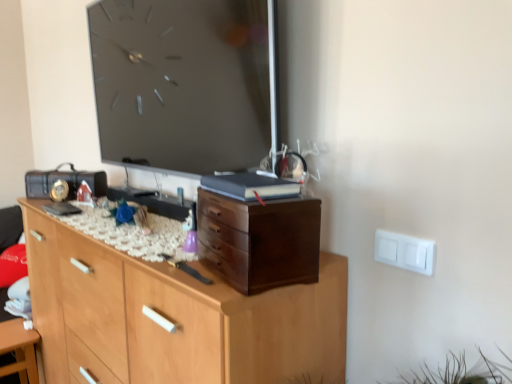
Question: Is white glossy table at lower left oriented towards dark wood chest of drawers at center, placed as the 1th chest of drawers when sorted from top to bottom?

Choices:
 (A) yes
 (B) no

Answer: (B)

Question: Is white glossy table at lower left further to the viewer compared to dark wood chest of drawers at center, placed as the 1th chest of drawers when sorted from top to bottom?

Choices:
 (A) yes
 (B) no

Answer: (A)

Question: Is white glossy table at lower left with dark wood chest of drawers at center, placed as the 1th chest of drawers when sorted from top to bottom?

Choices:
 (A) no
 (B) yes

Answer: (A)

Question: From the image's perspective, is white glossy table at lower left located beneath dark wood chest of drawers at center, placed as the 1th chest of drawers when sorted from top to bottom?

Choices:
 (A) no
 (B) yes

Answer: (B)

Question: Are white glossy table at lower left and dark wood chest of drawers at center, which appears as the second chest of drawers when ordered from the bottom, far apart?

Choices:
 (A) no
 (B) yes

Answer: (B)

Question: In terms of width, does dark wood chest of drawers at center, placed as the 1th chest of drawers when sorted from top to bottom, look wider or thinner when compared to white glossy table at lower left?

Choices:
 (A) thin
 (B) wide

Answer: (B)

Question: Would you say dark wood chest of drawers at center, placed as the 1th chest of drawers when sorted from top to bottom, is to the left or to the right of white glossy table at lower left in the picture?

Choices:
 (A) left
 (B) right

Answer: (B)

Question: In terms of height, does dark wood chest of drawers at center, which appears as the second chest of drawers when ordered from the bottom, look taller or shorter compared to white glossy table at lower left?

Choices:
 (A) tall
 (B) short

Answer: (B)

Question: Relative to white glossy table at lower left, is dark wood chest of drawers at center, which appears as the second chest of drawers when ordered from the bottom, in front or behind?

Choices:
 (A) behind
 (B) front

Answer: (B)

Question: In terms of height, does wooden chest of drawers at center, the first chest of drawers ordered from the bottom, look taller or shorter compared to white glossy table at lower left?

Choices:
 (A) tall
 (B) short

Answer: (A)

Question: From a real-world perspective, relative to white glossy table at lower left, is wooden chest of drawers at center, the first chest of drawers ordered from the bottom, vertically above or below?

Choices:
 (A) above
 (B) below

Answer: (A)

Question: Is wooden chest of drawers at center, the first chest of drawers ordered from the bottom, in front of or behind white glossy table at lower left in the image?

Choices:
 (A) front
 (B) behind

Answer: (A)

Question: Is wooden chest of drawers at center, arranged as the second chest of drawers when viewed from the top, bigger or smaller than white glossy table at lower left?

Choices:
 (A) small
 (B) big

Answer: (B)

Question: Is point (103, 337) positioned closer to the camera than point (292, 246)?

Choices:
 (A) farther
 (B) closer

Answer: (A)

Question: Relative to dark wood chest of drawers at center, which appears as the second chest of drawers when ordered from the bottom, is wooden chest of drawers at center, arranged as the second chest of drawers when viewed from the top, in front or behind?

Choices:
 (A) front
 (B) behind

Answer: (B)